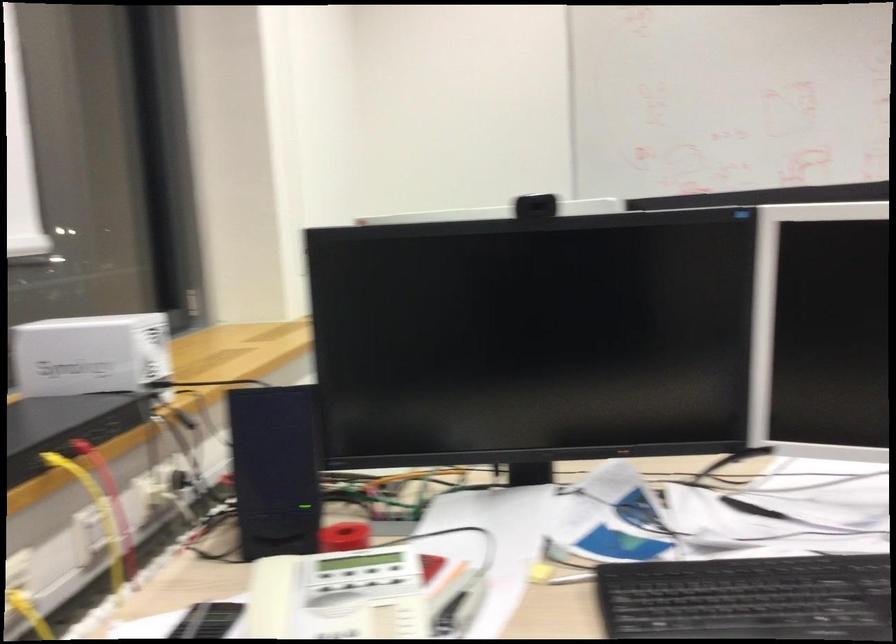
Where would you lift the red roll of tape? Please return your answer as a coordinate pair (x, y).

(343, 536)